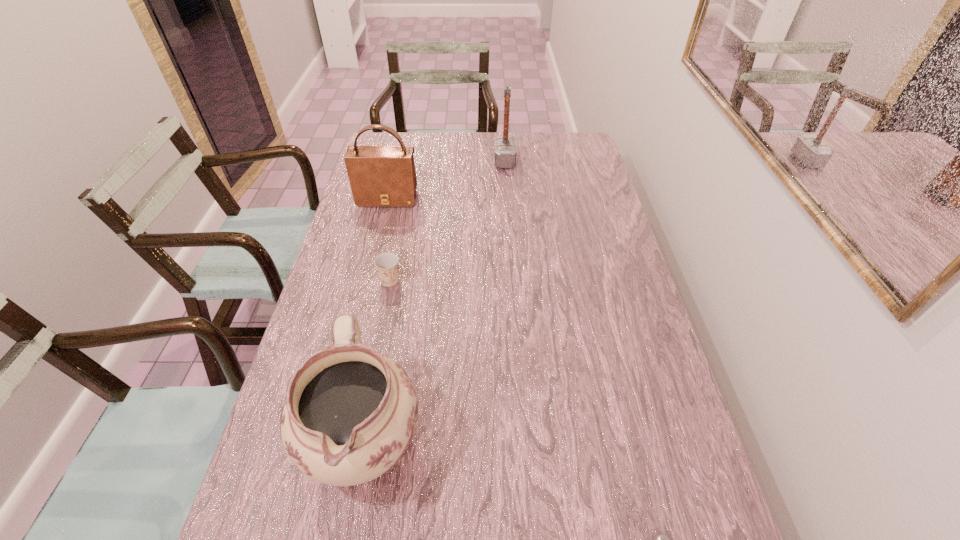
The width and height of the screenshot is (960, 540). Find the location of `vacant region that satisfies the following two spatial constraints: 1. on the striking surface of the farthest object; 2. on the spout of the fourth farthest object`. vacant region that satisfies the following two spatial constraints: 1. on the striking surface of the farthest object; 2. on the spout of the fourth farthest object is located at coordinates (524, 435).

At what (x,y) coordinates should I click in order to perform the action: click on vacant region that satisfies the following two spatial constraints: 1. on the front flap of the fourth nearest object; 2. on the right side of the third farthest object. Please return your answer as a coordinate pair (x, y). Looking at the image, I should click on (368, 280).